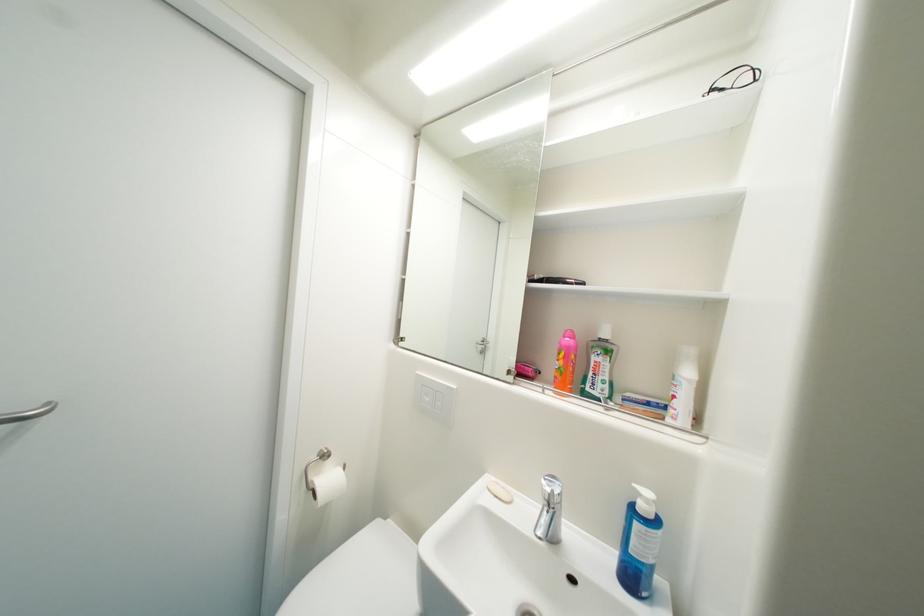
What do you see at coordinates (600, 367) in the screenshot?
I see `the mouthwash bottle cap` at bounding box center [600, 367].